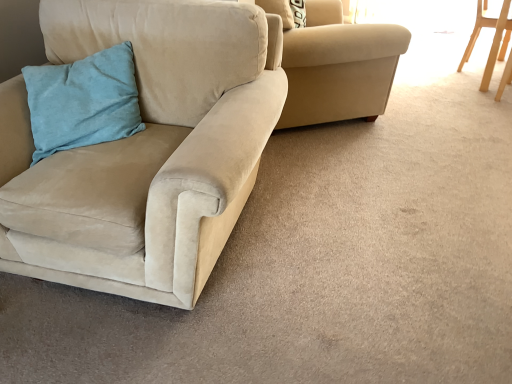
Question: Is the surface of suede beige armchair at upper center, the 2th chair when ordered from right to left, in direct contact with teal suede pillow at left?

Choices:
 (A) yes
 (B) no

Answer: (B)

Question: Considering the relative sizes of suede beige armchair at upper center, placed as the 2th chair when sorted from left to right, and teal suede pillow at left in the image provided, is suede beige armchair at upper center, placed as the 2th chair when sorted from left to right, bigger than teal suede pillow at left?

Choices:
 (A) no
 (B) yes

Answer: (B)

Question: From the image's perspective, is suede beige armchair at upper center, placed as the 2th chair when sorted from left to right, located above teal suede pillow at left?

Choices:
 (A) yes
 (B) no

Answer: (A)

Question: Considering the relative sizes of suede beige armchair at upper center, the 2th chair when ordered from right to left, and teal suede pillow at left in the image provided, is suede beige armchair at upper center, the 2th chair when ordered from right to left, taller than teal suede pillow at left?

Choices:
 (A) no
 (B) yes

Answer: (B)

Question: From a real-world perspective, is suede beige armchair at upper center, placed as the 2th chair when sorted from left to right, beneath teal suede pillow at left?

Choices:
 (A) yes
 (B) no

Answer: (A)

Question: From a real-world perspective, is suede beige armchair at upper center, the 2th chair when ordered from right to left, above or below suede beige couch at left, the 1th chair viewed from the left?

Choices:
 (A) below
 (B) above

Answer: (A)

Question: Is suede beige armchair at upper center, the 2th chair when ordered from right to left, in front of or behind suede beige couch at left, the 1th chair viewed from the left, in the image?

Choices:
 (A) front
 (B) behind

Answer: (B)

Question: Do you think suede beige armchair at upper center, placed as the 2th chair when sorted from left to right, is within suede beige couch at left, which appears as the 3th chair when viewed from the right, or outside of it?

Choices:
 (A) inside
 (B) outside

Answer: (B)

Question: In terms of size, does suede beige armchair at upper center, placed as the 2th chair when sorted from left to right, appear bigger or smaller than suede beige couch at left, which appears as the 3th chair when viewed from the right?

Choices:
 (A) big
 (B) small

Answer: (B)

Question: From a real-world perspective, is suede beige couch at left, which appears as the 3th chair when viewed from the right, physically located above or below light wood chair at upper right, which appears as the first chair when viewed from the right?

Choices:
 (A) below
 (B) above

Answer: (B)

Question: In the image, is suede beige couch at left, the 1th chair viewed from the left, positioned in front of or behind light wood chair at upper right, which appears as the first chair when viewed from the right?

Choices:
 (A) behind
 (B) front

Answer: (B)

Question: From the image's perspective, is suede beige couch at left, the 1th chair viewed from the left, positioned above or below light wood chair at upper right, which appears as the first chair when viewed from the right?

Choices:
 (A) below
 (B) above

Answer: (A)

Question: In terms of height, does suede beige couch at left, the 1th chair viewed from the left, look taller or shorter compared to light wood chair at upper right, which appears as the first chair when viewed from the right?

Choices:
 (A) short
 (B) tall

Answer: (B)

Question: From a real-world perspective, is suede beige armchair at upper center, placed as the 2th chair when sorted from left to right, physically located above or below teal suede pillow at left?

Choices:
 (A) above
 (B) below

Answer: (B)

Question: Based on their positions, is suede beige armchair at upper center, the 2th chair when ordered from right to left, located to the left or right of teal suede pillow at left?

Choices:
 (A) right
 (B) left

Answer: (A)